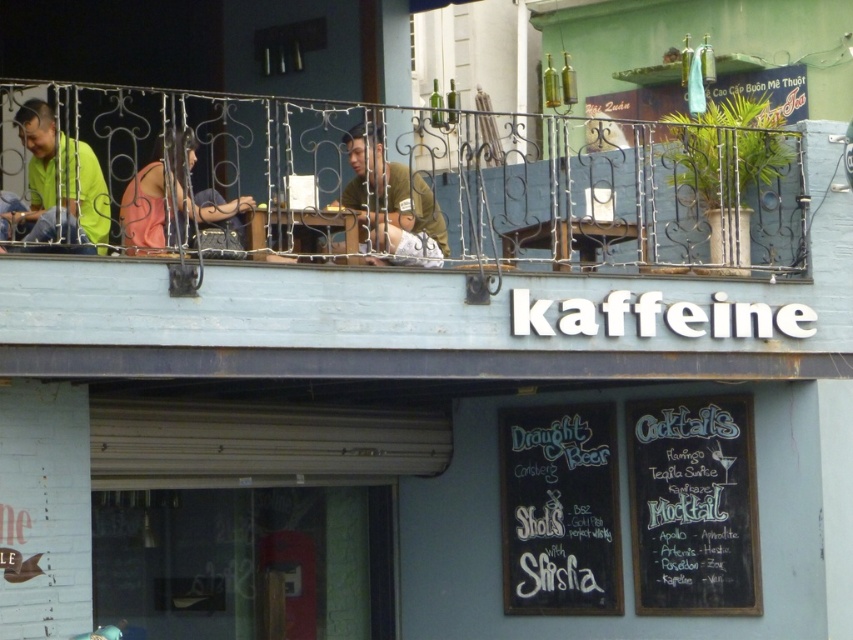
Question: Which of the following is the closest to the observer?

Choices:
 (A) green matte shirt at center
 (B) blue wooden balcony at upper center

Answer: (B)

Question: Which point is closer to the camera?

Choices:
 (A) green matte shirt at center
 (B) matte green shirt at left
 (C) blue wooden balcony at upper center

Answer: (C)

Question: Does black chalkboard at lower right appear on the left side of matte green shirt at left?

Choices:
 (A) yes
 (B) no

Answer: (B)

Question: Does black chalkboard at lower right appear on the left side of green matte shirt at center?

Choices:
 (A) yes
 (B) no

Answer: (B)

Question: Which point is closer to the camera taking this photo?

Choices:
 (A) (225, 216)
 (B) (38, 156)
 (C) (643, 515)

Answer: (A)

Question: Is the position of white chalkboard at lower center less distant than that of matte green shirt at left?

Choices:
 (A) yes
 (B) no

Answer: (B)